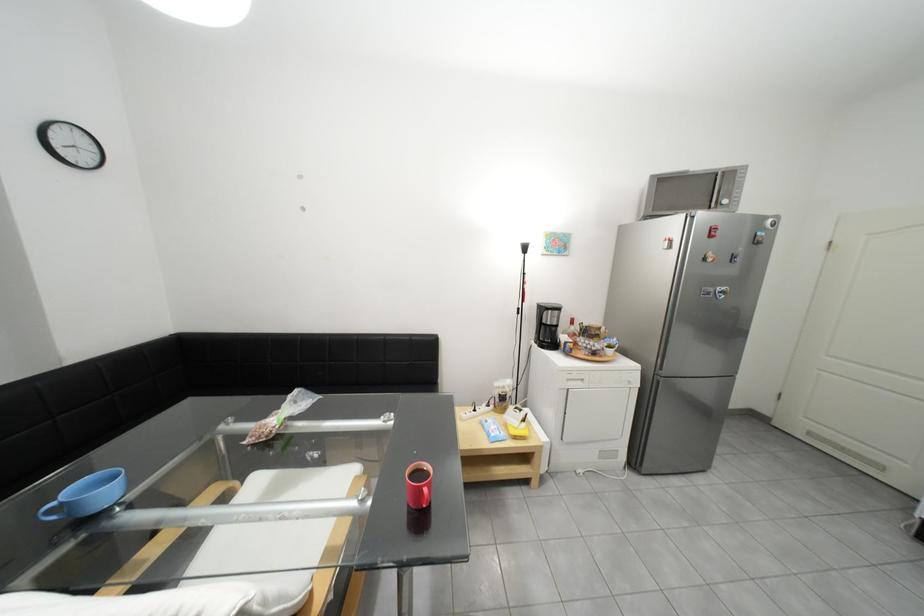
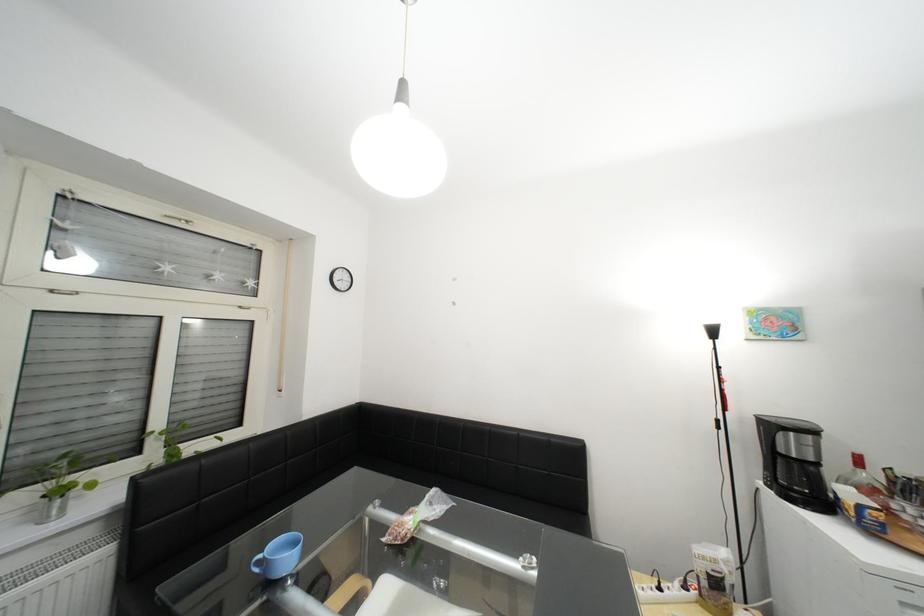
Locate, in the second image, the point that corresponds to [271,439] in the first image.

(407, 540)